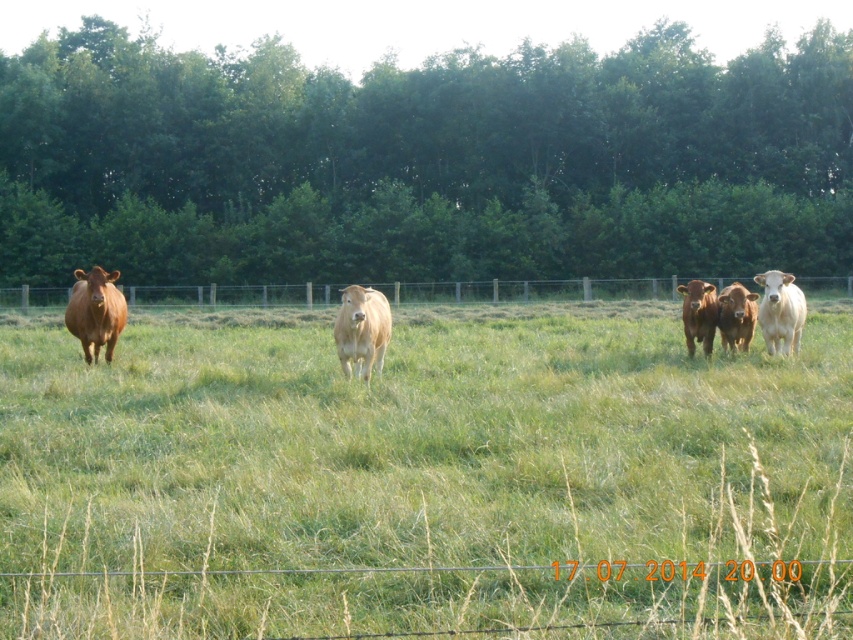
Question: Does metal wire fence at center have a larger size compared to brown smooth cow at right?

Choices:
 (A) no
 (B) yes

Answer: (B)

Question: Which object is positioned closest to the light brown cow at center?

Choices:
 (A) white smooth cow at center
 (B) green grassy field at center

Answer: (B)

Question: Does brown glossy cow at left appear on the left side of white smooth cow at center?

Choices:
 (A) no
 (B) yes

Answer: (B)

Question: Among these objects, which one is nearest to the camera?

Choices:
 (A) metal wire fence at center
 (B) brown matte cow at center

Answer: (B)

Question: Is metal wire fence at center behind white smooth cow at center?

Choices:
 (A) no
 (B) yes

Answer: (B)

Question: Considering the real-world distances, which object is closest to the brown smooth cow at right?

Choices:
 (A) green leafy trees at upper center
 (B) brown glossy cow at left
 (C) brown matte cow at center
 (D) green grassy field at center

Answer: (C)